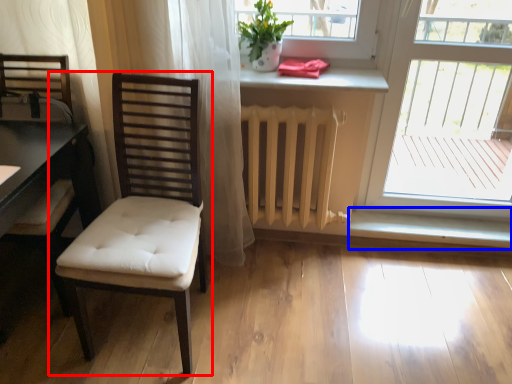
Question: Which of the following is the closest to the observer, chair (highlighted by a red box) or window sill (highlighted by a blue box)?

Choices:
 (A) chair
 (B) window sill

Answer: (A)